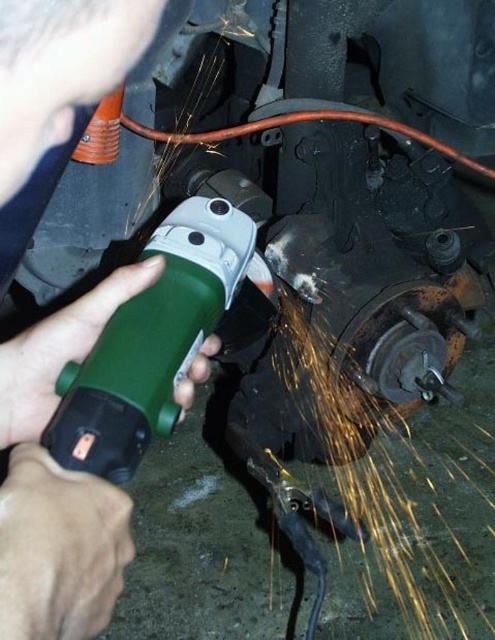
Question: Is the position of green plastic grinder at center less distant than that of green plastic angle grinder at center?

Choices:
 (A) no
 (B) yes

Answer: (B)

Question: Which point is farther to the camera?

Choices:
 (A) (235, 305)
 (B) (22, 70)

Answer: (A)

Question: Considering the relative positions of green plastic grinder at center and green plastic angle grinder at center in the image provided, where is green plastic grinder at center located with respect to green plastic angle grinder at center?

Choices:
 (A) below
 (B) above

Answer: (B)

Question: Does green plastic grinder at center have a larger size compared to green plastic angle grinder at center?

Choices:
 (A) no
 (B) yes

Answer: (B)